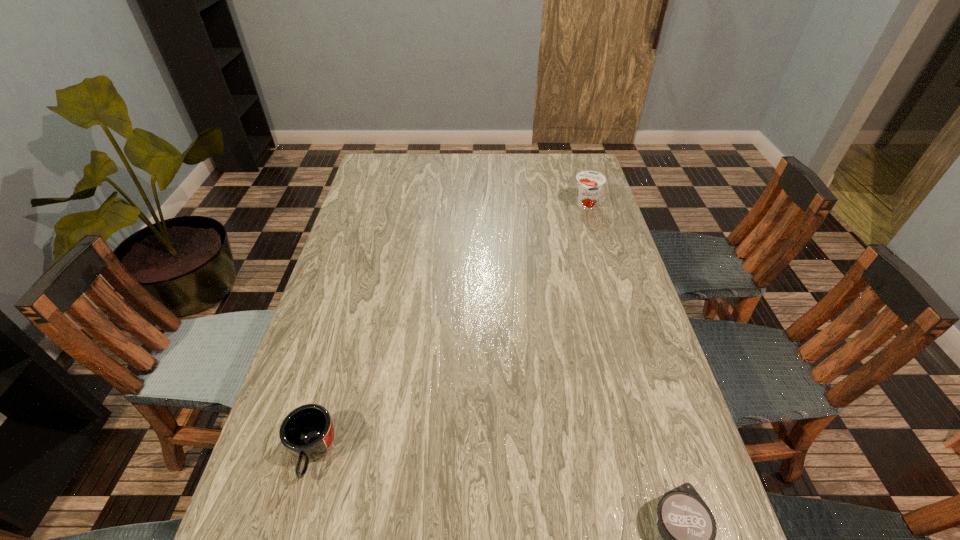
Where is `the farther yogurt`? The image size is (960, 540). the farther yogurt is located at coordinates (589, 183).

At what (x,y) coordinates should I click in order to perform the action: click on the tallest object. Please return your answer as a coordinate pair (x, y). The width and height of the screenshot is (960, 540). Looking at the image, I should click on (589, 183).

Where is `mug`? The image size is (960, 540). mug is located at coordinates (307, 432).

Identify the location of the leftmost object. This screenshot has height=540, width=960. (307, 432).

Identify the location of vacant space located 0.200m on the left of the tallest object. (516, 205).

Find the location of a particular element. The width and height of the screenshot is (960, 540). free space located 0.050m on the side of the leftmost object with the handle is located at coordinates tap(297, 513).

Locate an element on the screen. The height and width of the screenshot is (540, 960). object that is at the left edge is located at coordinates (307, 432).

Identify the location of object located at the right edge. (589, 183).

The image size is (960, 540). Identify the location of vacant space at the far edge of the desktop. (433, 181).

In the image, there is a desktop. Find the location of `blank space at the left edge`. blank space at the left edge is located at coordinates (317, 538).